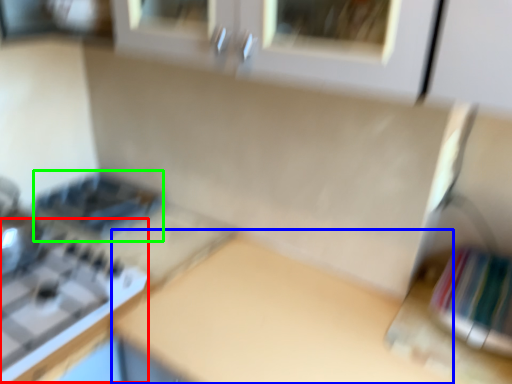
Question: Based on their relative distances, which object is nearer to gas stove (highlighted by a red box)? Choose from counter top (highlighted by a blue box) and appliance (highlighted by a green box).

Choices:
 (A) counter top
 (B) appliance

Answer: (A)